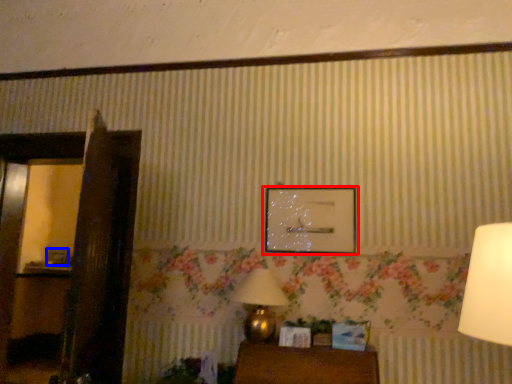
Question: Which object appears farthest to the camera in this image, picture frame (highlighted by a red box) or picture frame (highlighted by a blue box)?

Choices:
 (A) picture frame
 (B) picture frame

Answer: (B)